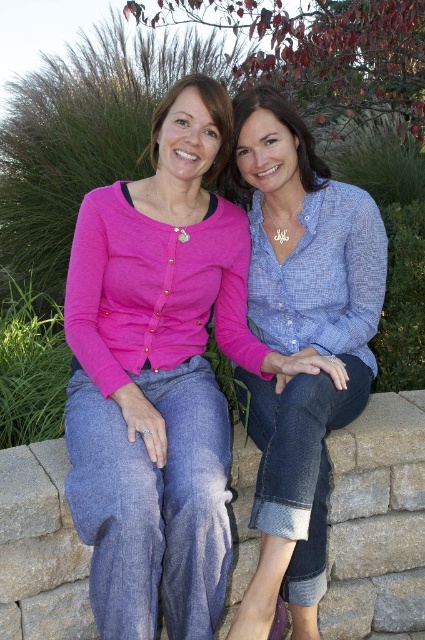
Image resolution: width=425 pixels, height=640 pixels. Describe the element at coordinates (158, 376) in the screenshot. I see `matte pink sweater at center` at that location.

Does point (187, 116) come farther from viewer compared to point (305, 502)?

Yes, point (187, 116) is farther from viewer.

Where is `matte pink sweater at center`? Image resolution: width=425 pixels, height=640 pixels. matte pink sweater at center is located at coordinates click(x=158, y=376).